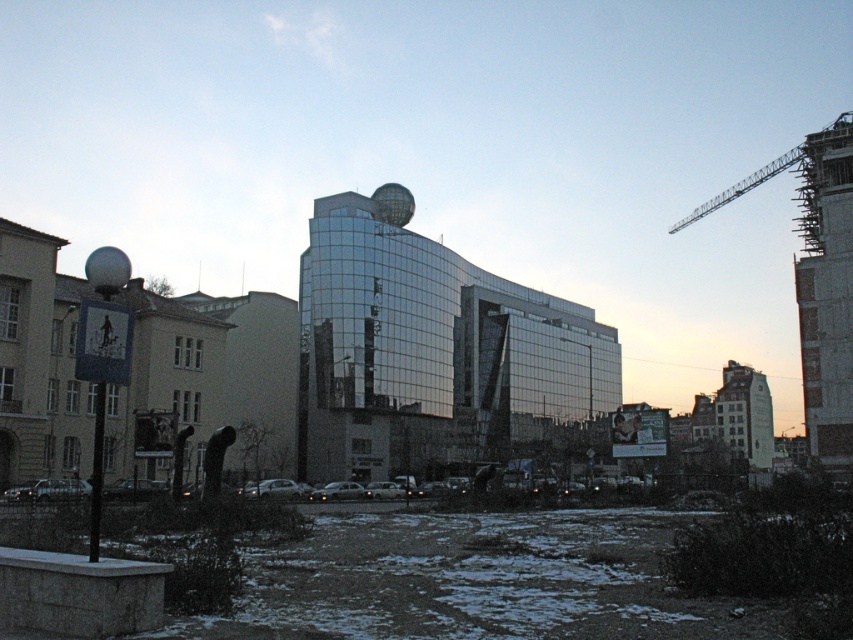
Is the position of glossy glass building at center less distant than that of metallic gray crane at upper right?

No, it is behind metallic gray crane at upper right.

Is glossy glass building at center behind metallic gray crane at upper right?

Yes, glossy glass building at center is further from the viewer.

Does point (358, 429) come closer to viewer compared to point (801, 173)?

No.

You are a GUI agent. You are given a task and a screenshot of the screen. Output one action in this format:
    pyautogui.click(x=<x>, y=<y>)
    Task: Click on the glossy glass building at center
    
    Given the screenshot: What is the action you would take?
    pyautogui.click(x=428, y=349)